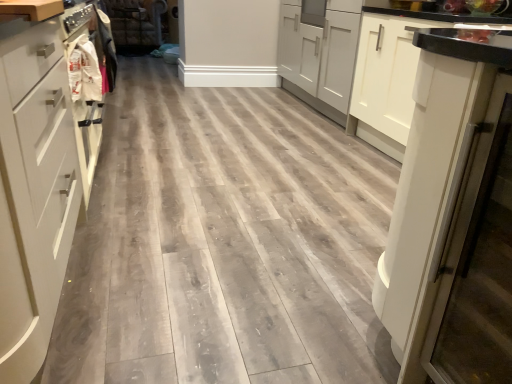
Question: From a real-world perspective, is faux leather couch at upper center below white fabric bag at left?

Choices:
 (A) yes
 (B) no

Answer: (A)

Question: Does faux leather couch at upper center have a lesser height compared to white fabric bag at left?

Choices:
 (A) yes
 (B) no

Answer: (B)

Question: Would you say faux leather couch at upper center contains white fabric bag at left?

Choices:
 (A) yes
 (B) no

Answer: (B)

Question: Does faux leather couch at upper center have a greater height compared to white fabric bag at left?

Choices:
 (A) no
 (B) yes

Answer: (B)

Question: From a real-world perspective, is faux leather couch at upper center located higher than white fabric bag at left?

Choices:
 (A) no
 (B) yes

Answer: (A)

Question: Is faux leather couch at upper center taller or shorter than white glossy refrigerator at right?

Choices:
 (A) tall
 (B) short

Answer: (B)

Question: Choose the correct answer: Is faux leather couch at upper center inside white glossy refrigerator at right or outside it?

Choices:
 (A) inside
 (B) outside

Answer: (B)

Question: Considering the positions of faux leather couch at upper center and white glossy refrigerator at right in the image, is faux leather couch at upper center wider or thinner than white glossy refrigerator at right?

Choices:
 (A) wide
 (B) thin

Answer: (A)

Question: From a real-world perspective, is faux leather couch at upper center positioned above or below white glossy refrigerator at right?

Choices:
 (A) below
 (B) above

Answer: (A)

Question: Is point (100, 99) positioned closer to the camera than point (336, 34)?

Choices:
 (A) farther
 (B) closer

Answer: (B)

Question: Is white fabric bag at left to the left or to the right of white matte cabinet at right, marked as the first cabinetry in a right-to-left arrangement, in the image?

Choices:
 (A) left
 (B) right

Answer: (A)

Question: From the image's perspective, is white fabric bag at left positioned above or below white matte cabinet at right, marked as the first cabinetry in a right-to-left arrangement?

Choices:
 (A) above
 (B) below

Answer: (B)

Question: Considering their positions, is white fabric bag at left located in front of or behind white matte cabinet at right, which is the first cabinetry from back to front?

Choices:
 (A) behind
 (B) front

Answer: (B)

Question: Does point click(x=292, y=1) appear closer or farther from the camera than point click(x=31, y=183)?

Choices:
 (A) farther
 (B) closer

Answer: (A)

Question: From a real-world perspective, is white matte cabinet at right, the second cabinetry viewed from the left, positioned above or below white matte drawer at left?

Choices:
 (A) below
 (B) above

Answer: (B)